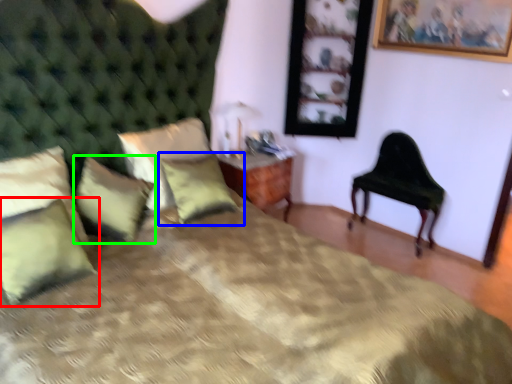
Question: Which object is the closest to the pillow (highlighted by a red box)? Choose among these: pillow (highlighted by a blue box) or pillow (highlighted by a green box).

Choices:
 (A) pillow
 (B) pillow

Answer: (B)